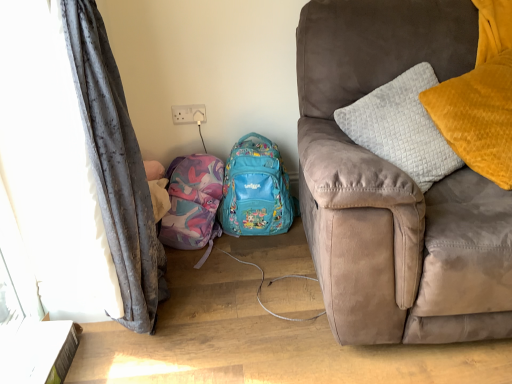
Question: Considering the relative positions of gray fabric curtain at left and teal fabric backpack at center, the first backpack positioned from the right, in the image provided, is gray fabric curtain at left behind teal fabric backpack at center, the first backpack positioned from the right,?

Choices:
 (A) no
 (B) yes

Answer: (A)

Question: Does gray fabric curtain at left have a greater width compared to teal fabric backpack at center, which is the 2th backpack in left-to-right order?

Choices:
 (A) yes
 (B) no

Answer: (A)

Question: Is gray fabric curtain at left positioned with its back to teal fabric backpack at center, which is the 2th backpack in left-to-right order?

Choices:
 (A) yes
 (B) no

Answer: (B)

Question: Does gray fabric curtain at left have a greater height compared to teal fabric backpack at center, the first backpack positioned from the right?

Choices:
 (A) no
 (B) yes

Answer: (B)

Question: From a real-world perspective, is gray fabric curtain at left on teal fabric backpack at center, which is the 2th backpack in left-to-right order?

Choices:
 (A) yes
 (B) no

Answer: (A)

Question: Considering the relative positions of teal fabric backpack at center, the first backpack positioned from the right, and suede couch at right in the image provided, is teal fabric backpack at center, the first backpack positioned from the right, to the left or to the right of suede couch at right?

Choices:
 (A) right
 (B) left

Answer: (B)

Question: Does point (236, 155) appear closer or farther from the camera than point (505, 314)?

Choices:
 (A) farther
 (B) closer

Answer: (A)

Question: From the image's perspective, is teal fabric backpack at center, the first backpack positioned from the right, positioned above or below suede couch at right?

Choices:
 (A) above
 (B) below

Answer: (B)

Question: Considering the positions of teal fabric backpack at center, the first backpack positioned from the right, and suede couch at right in the image, is teal fabric backpack at center, the first backpack positioned from the right, bigger or smaller than suede couch at right?

Choices:
 (A) small
 (B) big

Answer: (A)

Question: Is teal fabric backpack at center, the first backpack positioned from the right, bigger or smaller than matte pink fabric backpack at lower left, which ranks as the first backpack in left-to-right order?

Choices:
 (A) small
 (B) big

Answer: (B)

Question: Looking at their shapes, would you say teal fabric backpack at center, which is the 2th backpack in left-to-right order, is wider or thinner than matte pink fabric backpack at lower left, placed as the 2th backpack when sorted from right to left?

Choices:
 (A) thin
 (B) wide

Answer: (A)

Question: In terms of height, does teal fabric backpack at center, which is the 2th backpack in left-to-right order, look taller or shorter compared to matte pink fabric backpack at lower left, placed as the 2th backpack when sorted from right to left?

Choices:
 (A) tall
 (B) short

Answer: (A)

Question: From a real-world perspective, relative to matte pink fabric backpack at lower left, which ranks as the first backpack in left-to-right order, is teal fabric backpack at center, the first backpack positioned from the right, vertically above or below?

Choices:
 (A) below
 (B) above

Answer: (B)

Question: In terms of width, does matte pink fabric backpack at lower left, placed as the 2th backpack when sorted from right to left, look wider or thinner when compared to gray fabric curtain at left?

Choices:
 (A) wide
 (B) thin

Answer: (B)

Question: Based on their sizes in the image, would you say matte pink fabric backpack at lower left, placed as the 2th backpack when sorted from right to left, is bigger or smaller than gray fabric curtain at left?

Choices:
 (A) big
 (B) small

Answer: (B)